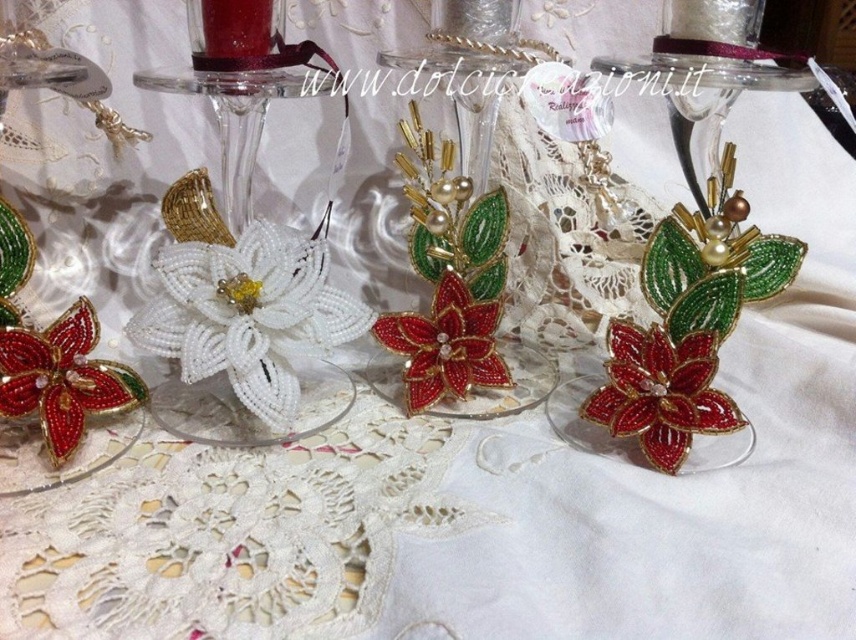
Question: Can you confirm if shiny red beaded flower at center right is bigger than matte red beaded flower at lower left?

Choices:
 (A) no
 (B) yes

Answer: (A)

Question: Does white beaded flower at center left have a smaller size compared to matte red beaded flower at lower left?

Choices:
 (A) no
 (B) yes

Answer: (A)

Question: Can you confirm if shiny red beaded flower at center right is thinner than shiny red beaded flower at center?

Choices:
 (A) no
 (B) yes

Answer: (A)

Question: Which point appears closest to the camera in this image?

Choices:
 (A) (440, 348)
 (B) (63, 364)
 (C) (210, 285)
 (D) (602, 422)

Answer: (B)

Question: Among these points, which one is nearest to the camera?

Choices:
 (A) (464, 316)
 (B) (235, 244)
 (C) (721, 410)

Answer: (C)

Question: Based on their relative distances, which object is farther from the white beaded flower at center left?

Choices:
 (A) shiny red beaded flower at center
 (B) shiny red beaded flower at center right
 (C) matte red beaded flower at lower left

Answer: (B)